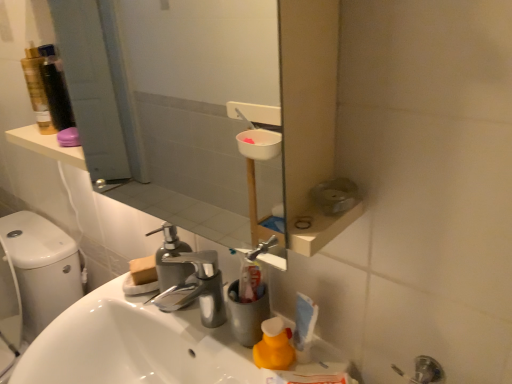
Image resolution: width=512 pixels, height=384 pixels. I want to click on blank area to the left of chrome metallic faucet at center, so click(x=115, y=303).